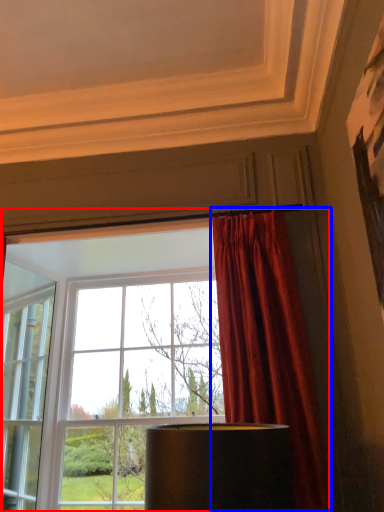
Question: Which of the following is the closest to the observer, window (highlighted by a red box) or curtain (highlighted by a blue box)?

Choices:
 (A) window
 (B) curtain

Answer: (B)